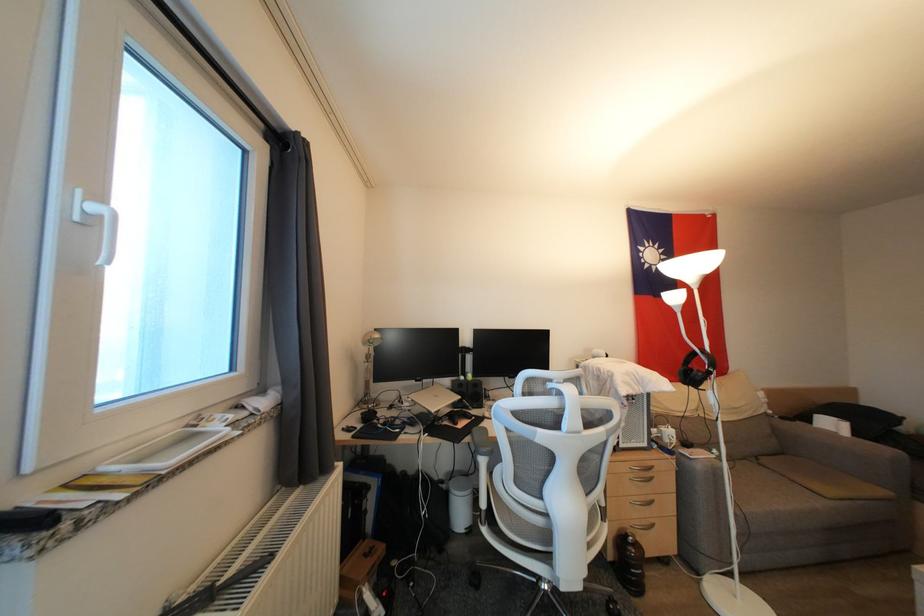
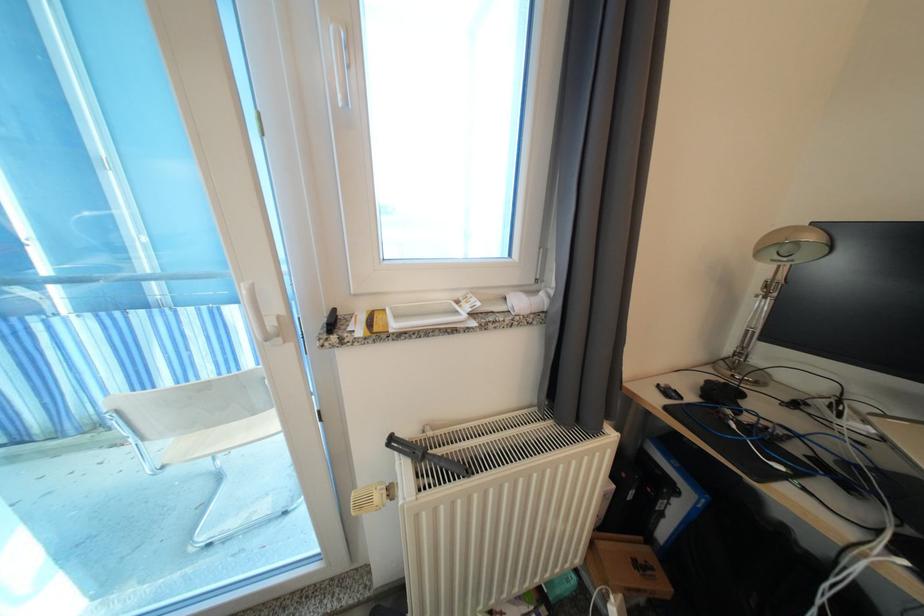
Locate, in the second image, the point that corresponds to point 382,339 in the first image.

(818, 241)